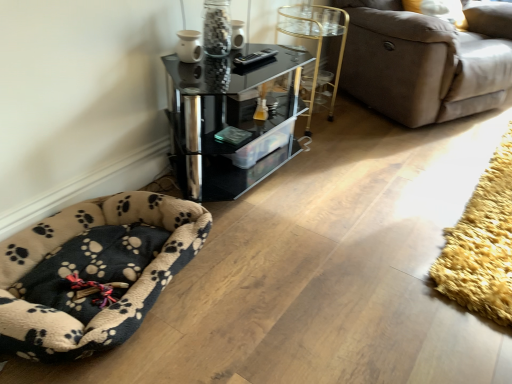
Question: Does beige fleece dog bed at lower left turn towards black glass table at upper center?

Choices:
 (A) no
 (B) yes

Answer: (A)

Question: Is beige fleece dog bed at lower left taller than black glass table at upper center?

Choices:
 (A) yes
 (B) no

Answer: (B)

Question: Does beige fleece dog bed at lower left come in front of black glass table at upper center?

Choices:
 (A) yes
 (B) no

Answer: (A)

Question: Can you confirm if beige fleece dog bed at lower left is bigger than black glass table at upper center?

Choices:
 (A) no
 (B) yes

Answer: (A)

Question: From a real-world perspective, does beige fleece dog bed at lower left stand above black glass table at upper center?

Choices:
 (A) yes
 (B) no

Answer: (B)

Question: Is gold metallic side table at upper center bigger or smaller than black glass table at upper center?

Choices:
 (A) big
 (B) small

Answer: (B)

Question: Does point (310, 107) appear closer or farther from the camera than point (194, 183)?

Choices:
 (A) farther
 (B) closer

Answer: (A)

Question: In the image, is gold metallic side table at upper center positioned in front of or behind black glass table at upper center?

Choices:
 (A) behind
 (B) front

Answer: (A)

Question: In the image, is gold metallic side table at upper center on the left side or the right side of black glass table at upper center?

Choices:
 (A) right
 (B) left

Answer: (A)

Question: Considering the positions of brown fabric couch at upper right and yellow shaggy rug at lower right in the image, is brown fabric couch at upper right taller or shorter than yellow shaggy rug at lower right?

Choices:
 (A) tall
 (B) short

Answer: (A)

Question: Is point (493, 91) positioned closer to the camera than point (478, 188)?

Choices:
 (A) closer
 (B) farther

Answer: (B)

Question: In terms of size, does brown fabric couch at upper right appear bigger or smaller than yellow shaggy rug at lower right?

Choices:
 (A) small
 (B) big

Answer: (B)

Question: Relative to yellow shaggy rug at lower right, is brown fabric couch at upper right in front or behind?

Choices:
 (A) behind
 (B) front

Answer: (A)

Question: From a real-world perspective, is black glass table at upper center positioned above or below yellow shaggy rug at lower right?

Choices:
 (A) above
 (B) below

Answer: (A)

Question: Considering the positions of point (215, 145) and point (437, 286), is point (215, 145) closer or farther from the camera than point (437, 286)?

Choices:
 (A) farther
 (B) closer

Answer: (A)